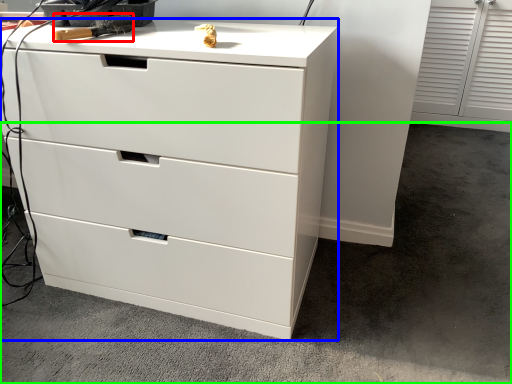
Question: Considering the real-world distances, which object is closest to tool (highlighted by a red box)? chest of drawers (highlighted by a blue box) or concrete (highlighted by a green box).

Choices:
 (A) chest of drawers
 (B) concrete

Answer: (A)